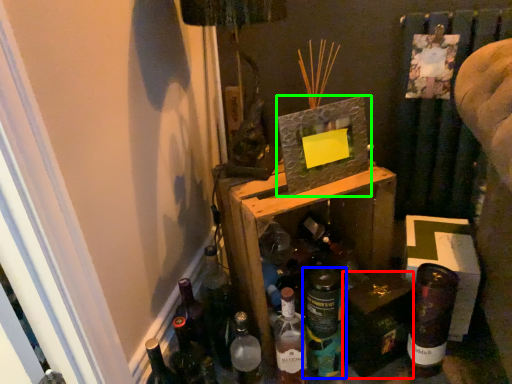
Question: Estimate the real-world distances between objects in this image. Which object is farther from box (highlighted by a red box), bottle (highlighted by a blue box) or picture frame (highlighted by a green box)?

Choices:
 (A) bottle
 (B) picture frame

Answer: (B)